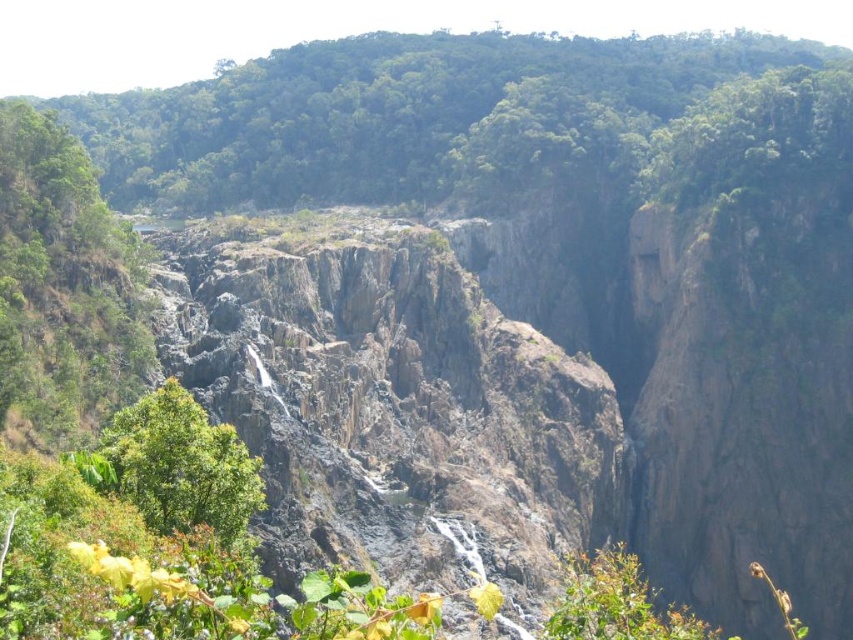
Can you confirm if green leafy trees at upper center is positioned above green leafy tree at lower left?

Yes, green leafy trees at upper center is above green leafy tree at lower left.

Locate an element on the screen. green leafy trees at upper center is located at coordinates (381, 109).